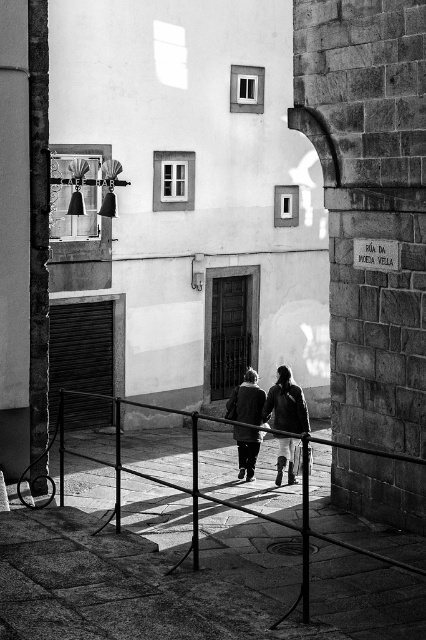
You are standing in the middle of the alleyway and see the smooth metal railing at center and the dark gray fabric coat at center. Which object is closer to the left side of the alley?

The smooth metal railing at center is closer to the left side of the alley because it is positioned to the left of the dark gray fabric coat at center.

You are a delivery person who needs to place a package on the ground in the middle of the alleyway. However, there is a dark gray fabric coat at center. Where should you place the package so it doesn not disturb the coat?

The dark gray fabric coat at center is located at point (270, 403), so place the package away from that coordinate to avoid disturbing the coat.

You are standing in the middle of the alleyway and notice a smooth metal railing at center and a dark gray fabric coat at center. Which object is closer to the ground?

The smooth metal railing at center is located below the dark gray fabric coat at center, so it is closer to the ground.